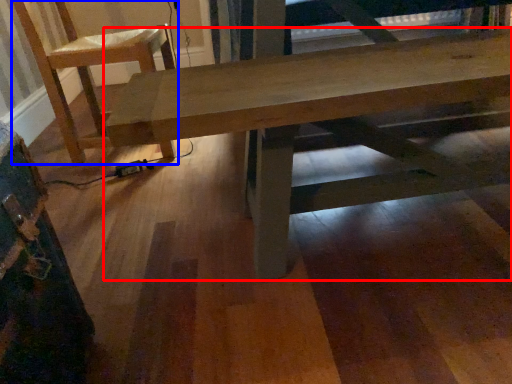
Question: Which of the following is the farthest to the observer, table (highlighted by a red box) or chair (highlighted by a blue box)?

Choices:
 (A) table
 (B) chair

Answer: (B)